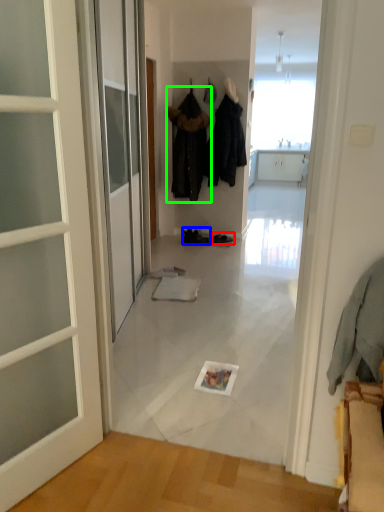
Question: Which is farther away from footwear (highlighted by a red box)? footwear (highlighted by a blue box) or clothing (highlighted by a green box)?

Choices:
 (A) footwear
 (B) clothing

Answer: (B)